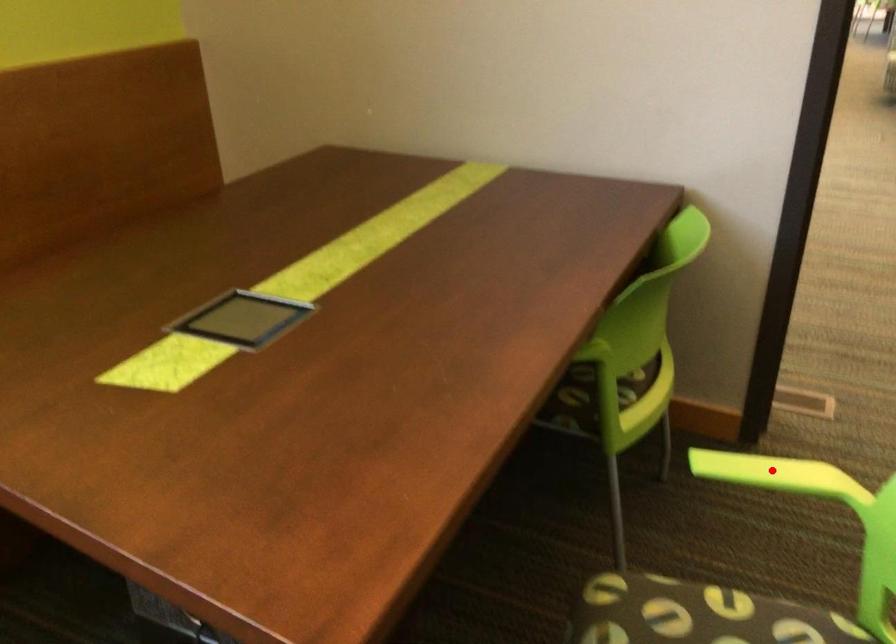
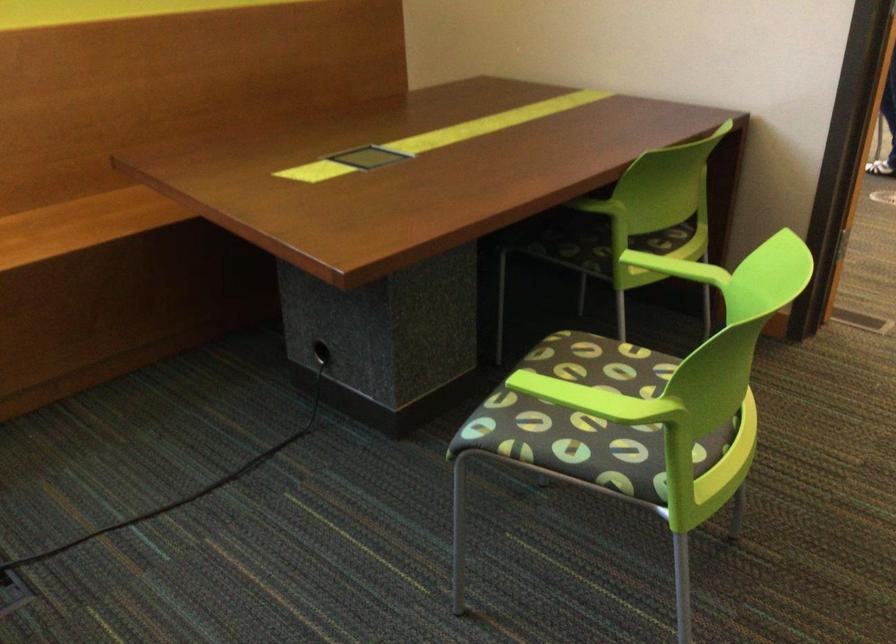
In the second image, find the point that corresponds to the highlighted location in the first image.

(676, 268)